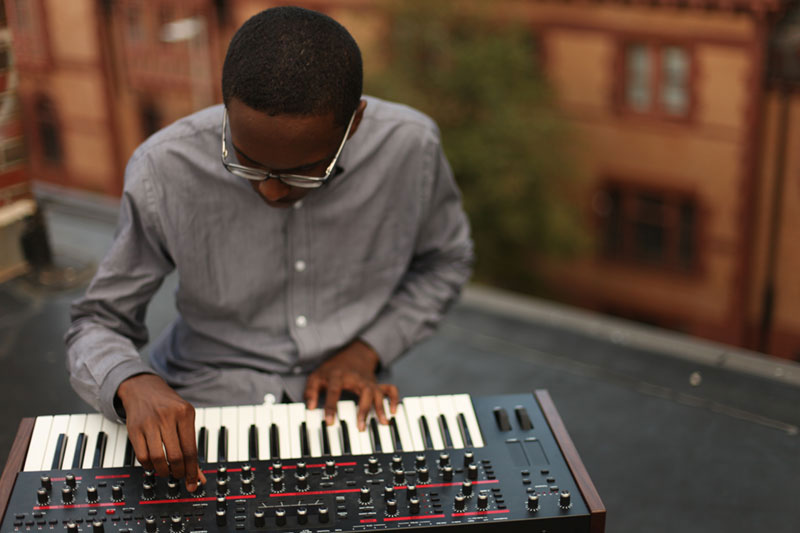
Locate an element on the screen. background windows is located at coordinates (650, 83), (646, 255), (180, 29), (156, 119), (65, 127), (138, 30).